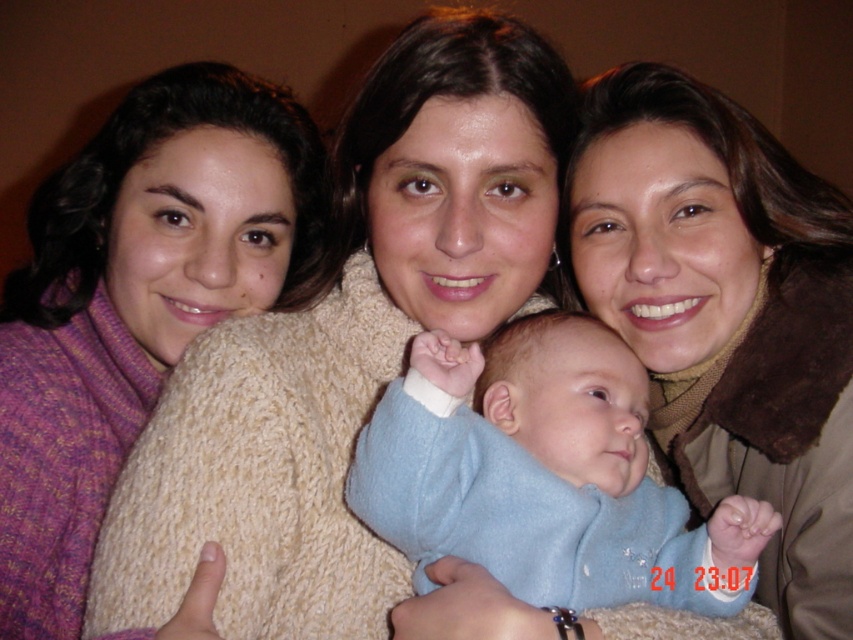
Question: Can you confirm if purple knitted sweater at left is wider than light blue fleece at center?

Choices:
 (A) no
 (B) yes

Answer: (B)

Question: Which object is positioned farthest from the knitted sweater at center?

Choices:
 (A) purple knitted sweater at left
 (B) beige knitted sweater at center

Answer: (B)

Question: Among these objects, which one is farthest from the camera?

Choices:
 (A) purple knitted sweater at left
 (B) light blue fleece at center
 (C) knitted sweater at center

Answer: (C)

Question: In this image, where is knitted sweater at center located relative to beige knitted sweater at center?

Choices:
 (A) above
 (B) below

Answer: (B)

Question: Which object appears closest to the camera in this image?

Choices:
 (A) light blue fleece at center
 (B) knitted sweater at center
 (C) purple knitted sweater at left

Answer: (C)

Question: Does knitted sweater at center appear under purple knitted sweater at left?

Choices:
 (A) yes
 (B) no

Answer: (A)